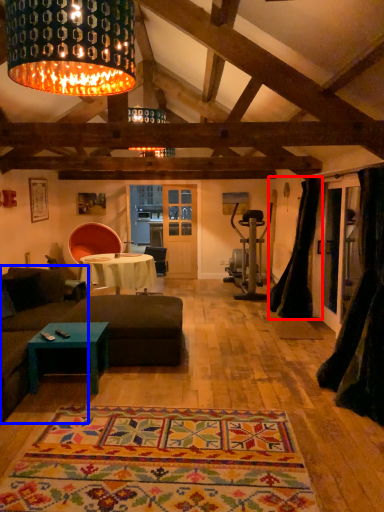
Question: Which of the following is the farthest to the observer, curtain (highlighted by a red box) or couch (highlighted by a blue box)?

Choices:
 (A) curtain
 (B) couch

Answer: (A)